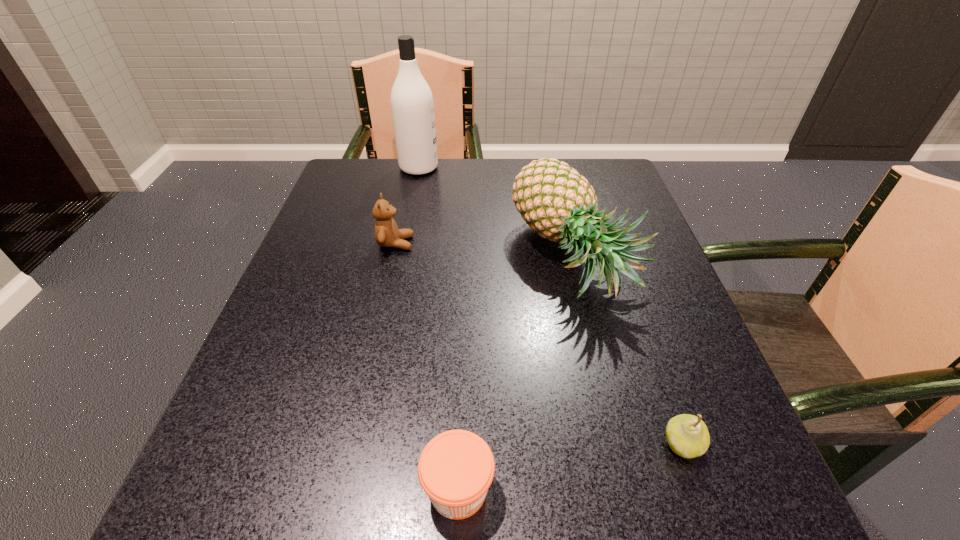
Locate an element on the screen. The width and height of the screenshot is (960, 540). blank area in the image that satisfies the following two spatial constraints: 1. on the front-facing side of the shampoo; 2. on the left side of the second shortest object is located at coordinates tap(363, 443).

Where is `vacant region that satisfies the following two spatial constraints: 1. on the front-facing side of the tallest object; 2. on the right side of the fourth shortest object`? This screenshot has height=540, width=960. vacant region that satisfies the following two spatial constraints: 1. on the front-facing side of the tallest object; 2. on the right side of the fourth shortest object is located at coordinates (401, 256).

You are a GUI agent. You are given a task and a screenshot of the screen. Output one action in this format:
    pyautogui.click(x=<x>, y=<y>)
    Task: Click on the free region that satisfies the following two spatial constraints: 1. on the front-facing side of the tallest object; 2. on the left side of the pear
    This screenshot has height=540, width=960.
    Given the screenshot: What is the action you would take?
    pyautogui.click(x=363, y=443)

At what (x,y) coordinates should I click in order to perform the action: click on free spot that satisfies the following two spatial constraints: 1. on the front-facing side of the tallest object; 2. on the right side of the fourth tallest object. Please return your answer as a coordinate pair (x, y). Looking at the image, I should click on (363, 443).

The height and width of the screenshot is (540, 960). Identify the location of free spot that satisfies the following two spatial constraints: 1. on the back side of the pineapple; 2. on the front-facing side of the farthest object. (553, 167).

What are the coordinates of `vacant region that satisfies the following two spatial constraints: 1. on the front-facing side of the shampoo; 2. on the right side of the fourth tallest object` in the screenshot? It's located at (363, 443).

The width and height of the screenshot is (960, 540). Identify the location of free region that satisfies the following two spatial constraints: 1. on the front-facing side of the teddy bear; 2. on the left side of the fourth shortest object. (393, 256).